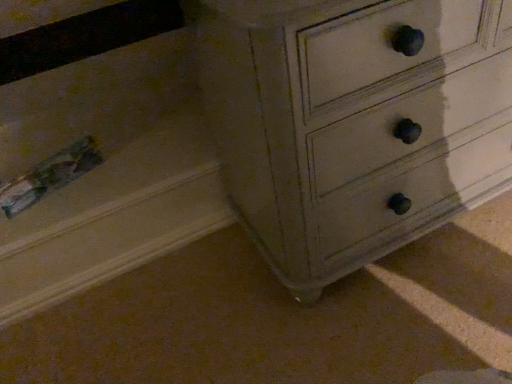
Describe the element at coordinates (106, 171) in the screenshot. I see `wooden drawer at lower left` at that location.

Find the location of a particular element. The image size is (512, 384). wooden drawer at lower left is located at coordinates (106, 171).

Find the location of a particular element. wooden drawer at lower left is located at coordinates pos(106,171).